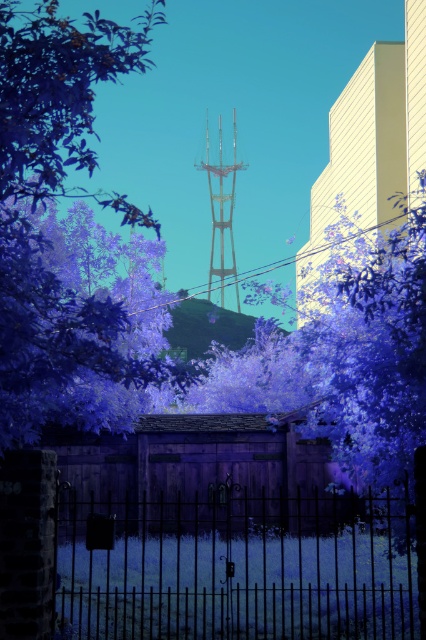
You are a drone operator who needs to fly a drone from the purple leafy tree at center to the metallic wire at upper center. The drone has a maximum flight range of 10 meters. Can you safely make the trip without needing to recharge?

The distance between the purple leafy tree at center and the metallic wire at upper center is 11.81 meters. Since the drone can only fly 10 meters before needing to recharge, it cannot safely make the trip without recharging.